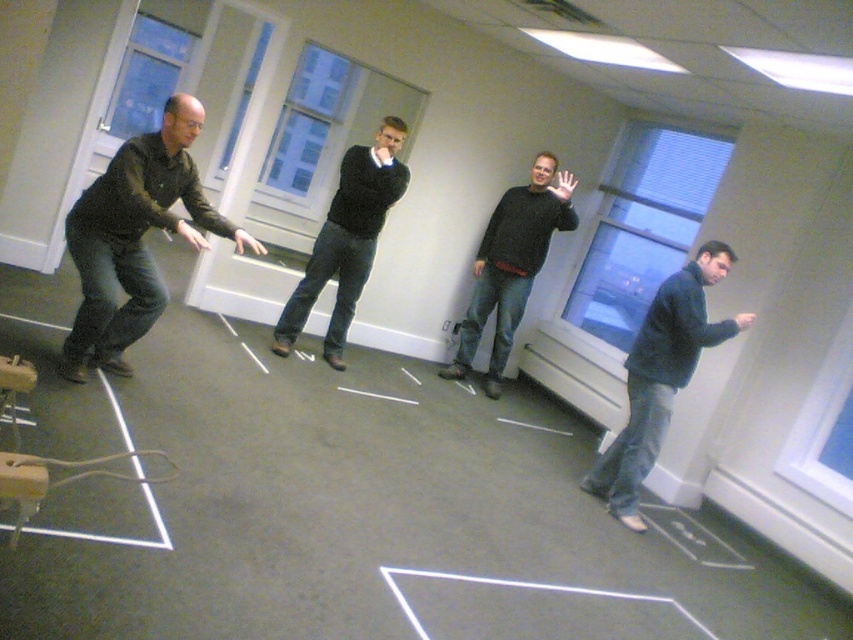
Who is more distant from viewer, (694, 353) or (471, 323)?

Point (471, 323)

Describe the element at coordinates (660, 376) in the screenshot. Image resolution: width=853 pixels, height=640 pixels. I see `dark blue jeans at lower right` at that location.

Find the location of `dark blue jeans at lower right`. dark blue jeans at lower right is located at coordinates (660, 376).

Is dark blue jeans at lower right below black sweater at center?

Yes.

Which is behind, point (651, 420) or point (335, 312)?

The point (335, 312) is more distant.

Between point (689, 326) and point (379, 228), which one is positioned behind?

The point (379, 228) is behind.

Where is `dark blue jeans at lower right`? This screenshot has width=853, height=640. dark blue jeans at lower right is located at coordinates (660, 376).

Can you confirm if dark green sweater at left is positioned above dark gray sweater at center?

Incorrect, dark green sweater at left is not positioned above dark gray sweater at center.

Is dark green sweater at left shorter than dark gray sweater at center?

Correct, dark green sweater at left is not as tall as dark gray sweater at center.

Between point (74, 328) and point (509, 195), which one is positioned behind?

Positioned behind is point (509, 195).

Find the location of a particular element. Image resolution: width=853 pixels, height=640 pixels. dark green sweater at left is located at coordinates (135, 237).